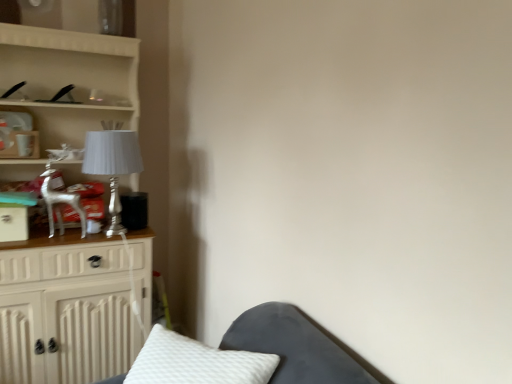
Question: Considering their positions, is white glossy cabinet at left located in front of or behind silver metallic table lamp at left?

Choices:
 (A) front
 (B) behind

Answer: (A)

Question: From a real-world perspective, is white glossy cabinet at left physically located above or below silver metallic table lamp at left?

Choices:
 (A) below
 (B) above

Answer: (A)

Question: Which is correct: white glossy cabinet at left is inside silver metallic table lamp at left, or outside of it?

Choices:
 (A) outside
 (B) inside

Answer: (A)

Question: Visually, is silver metallic table lamp at left positioned to the left or to the right of white glossy cabinet at left?

Choices:
 (A) left
 (B) right

Answer: (B)

Question: Does point (104, 152) appear closer or farther from the camera than point (144, 309)?

Choices:
 (A) farther
 (B) closer

Answer: (B)

Question: From the image's perspective, relative to white glossy cabinet at left, is silver metallic table lamp at left above or below?

Choices:
 (A) above
 (B) below

Answer: (A)

Question: Is silver metallic table lamp at left situated inside white glossy cabinet at left or outside?

Choices:
 (A) outside
 (B) inside

Answer: (B)